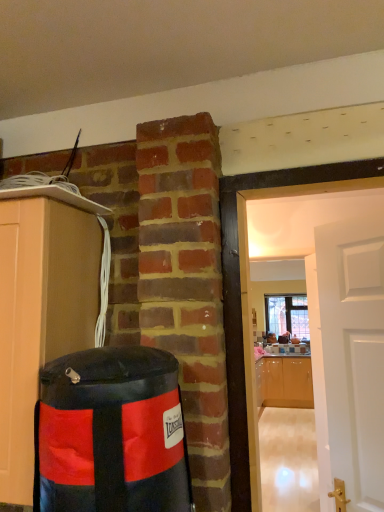
Question: Based on their sizes in the image, would you say black vinyl punching bag at left is bigger or smaller than clear glass window at center?

Choices:
 (A) big
 (B) small

Answer: (B)

Question: From a real-world perspective, is black vinyl punching bag at left physically located above or below clear glass window at center?

Choices:
 (A) above
 (B) below

Answer: (B)

Question: Considering the real-world distances, which object is farthest from the black vinyl punching bag at left?

Choices:
 (A) clear glass window at center
 (B) glossy wood cabinets at right, placed as the 2th cabinetry when sorted from front to back
 (C) matte wood cabinet at left, the first cabinetry in the front-to-back sequence

Answer: (A)

Question: Estimate the real-world distances between objects in this image. Which object is closer to the glossy wood cabinets at right, which ranks as the second cabinetry in top-to-bottom order?

Choices:
 (A) clear glass window at center
 (B) black vinyl punching bag at left
 (C) matte wood cabinet at left, which is counted as the 1th cabinetry, starting from the left

Answer: (A)